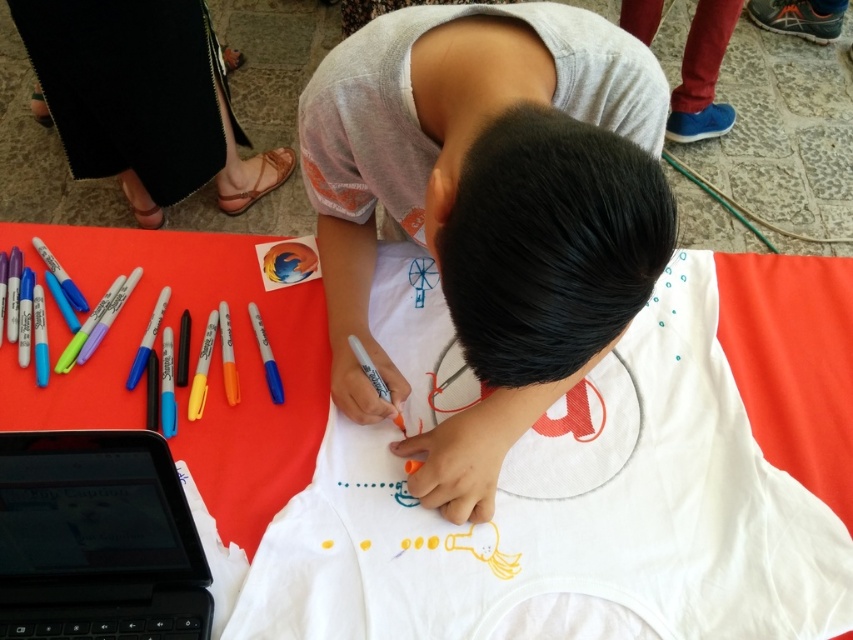
You are organizing a craft activity and need to place a new set of colored pencils on the table. The white fabric at center is currently at position coordinates 0.802, 0.672. Where should you place the pencils so they don not interfere with the child s artwork?

The white fabric at center is located at point (572, 513). To avoid interfering with the child s artwork, place the colored pencils in an area of the table that is not occupied by the fabric, such as near the left side where the Sharpie markers are already arranged.

You are standing at the center of the table and want to reach both the orange marker and the tablet device. The orange marker is located at point [486,284] and the tablet is at point [38,458]. Which object should you reach for first to minimize the distance traveled?

Point [486,284] is in front of point [38,458], so you should reach for the orange marker first as it is closer to you.

You are standing in front of the table where the child is working. There are two points marked on the table. One is at coordinates point (463, 384) and the other is at point (566, 362). Which point is closer to you?

Point (463, 384) is further to the camera than point (566, 362), so the point closer to you is point (566, 362).